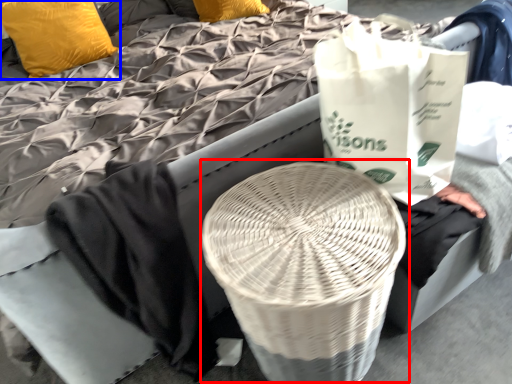
Question: Which of the following is the farthest to the observer, round table (highlighted by a red box) or pillow (highlighted by a blue box)?

Choices:
 (A) round table
 (B) pillow

Answer: (B)